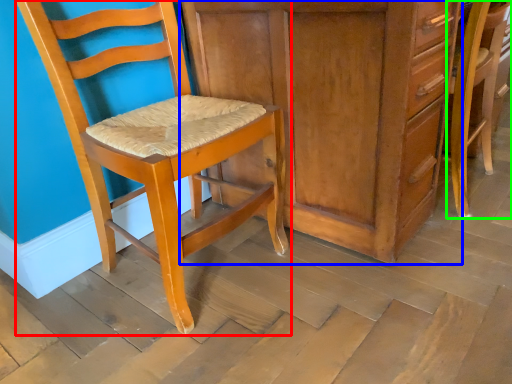
Question: Considering the real-world distances, which object is farthest from chair (highlighted by a red box)? cabinetry (highlighted by a blue box) or chair (highlighted by a green box)?

Choices:
 (A) cabinetry
 (B) chair

Answer: (B)